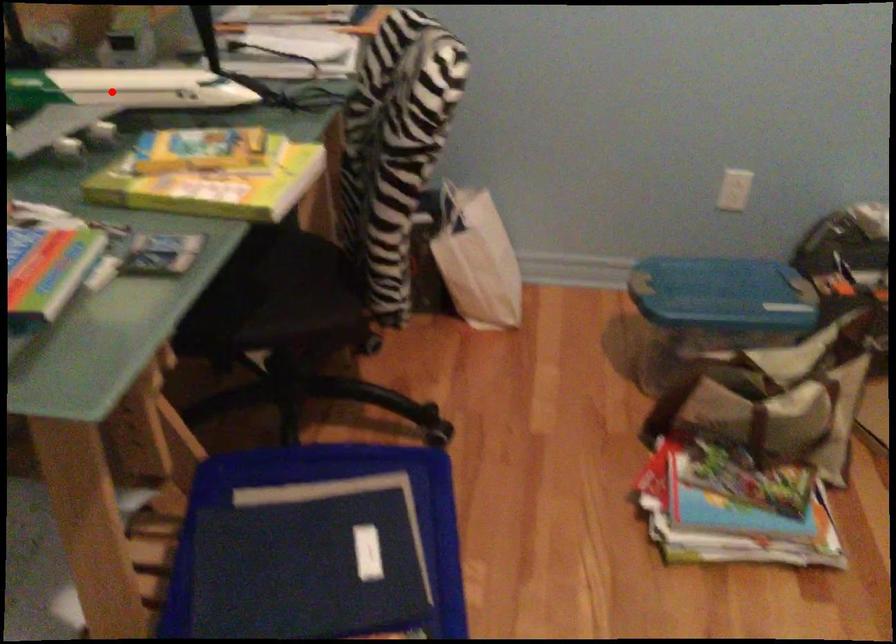
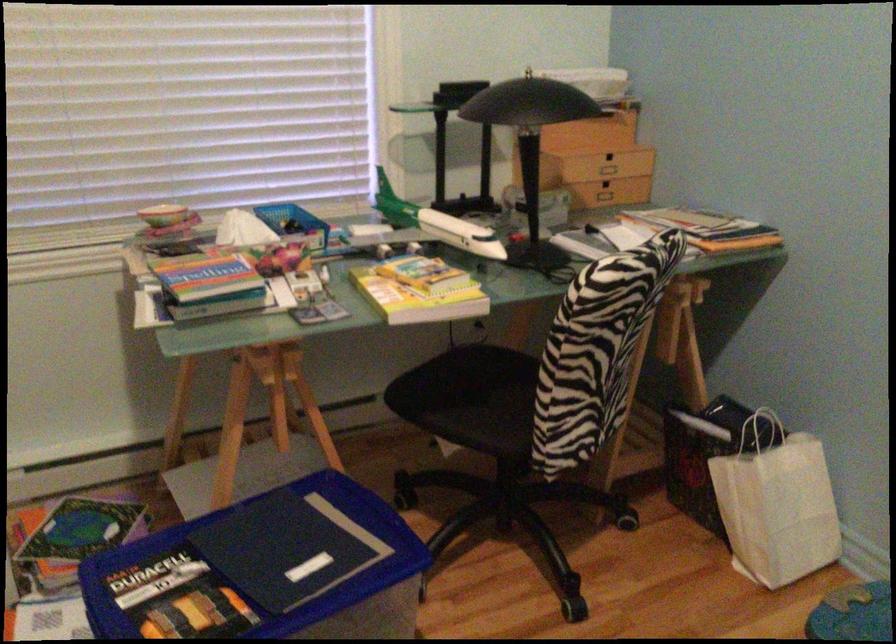
Question: A red point is marked in image1. In image2, is the corresponding 3D point closer to the camera or farther? Reply with the corresponding letter.

Choices:
 (A) The corresponding 3D point is closer.
 (B) The corresponding 3D point is farther.

Answer: (B)